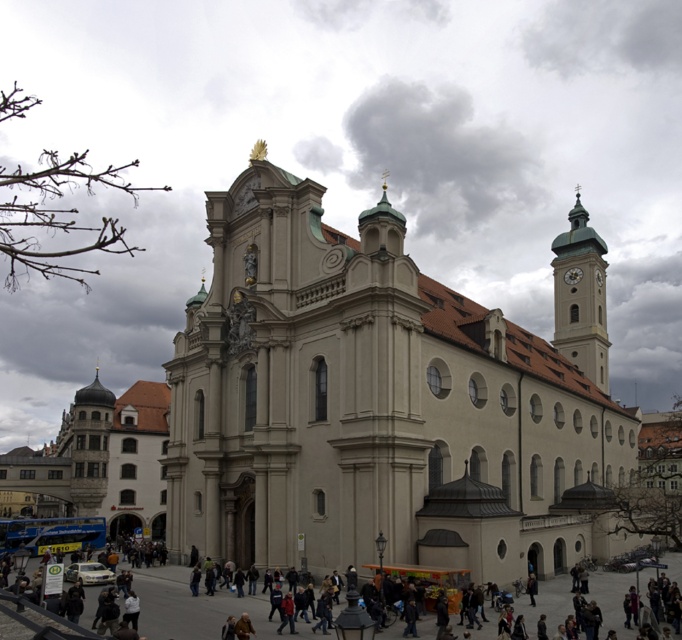
Which is above, beige stone church at center or concrete pavement at center?

Positioned higher is beige stone church at center.

Does beige stone church at center have a smaller size compared to concrete pavement at center?

No, beige stone church at center is not smaller than concrete pavement at center.

Between point (578, 397) and point (181, 576), which one is positioned behind?

The point (578, 397) is more distant.

The height and width of the screenshot is (640, 682). In order to click on beige stone church at center in this screenshot , I will do `click(383, 401)`.

Is beige stone church at center below metallic clock tower at upper right?

Correct, beige stone church at center is located below metallic clock tower at upper right.

Between point (561, 483) and point (572, 284), which one is positioned in front?

Point (561, 483)

What do you see at coordinates (383, 401) in the screenshot?
I see `beige stone church at center` at bounding box center [383, 401].

The image size is (682, 640). Identify the location of beige stone church at center. tap(383, 401).

Between concrete pavement at center and metallic clock tower at upper right, which one is positioned lower?

concrete pavement at center is below.

Is point (606, 577) farther from viewer compared to point (569, 273)?

No, it is not.

This screenshot has width=682, height=640. I want to click on concrete pavement at center, so click(x=192, y=605).